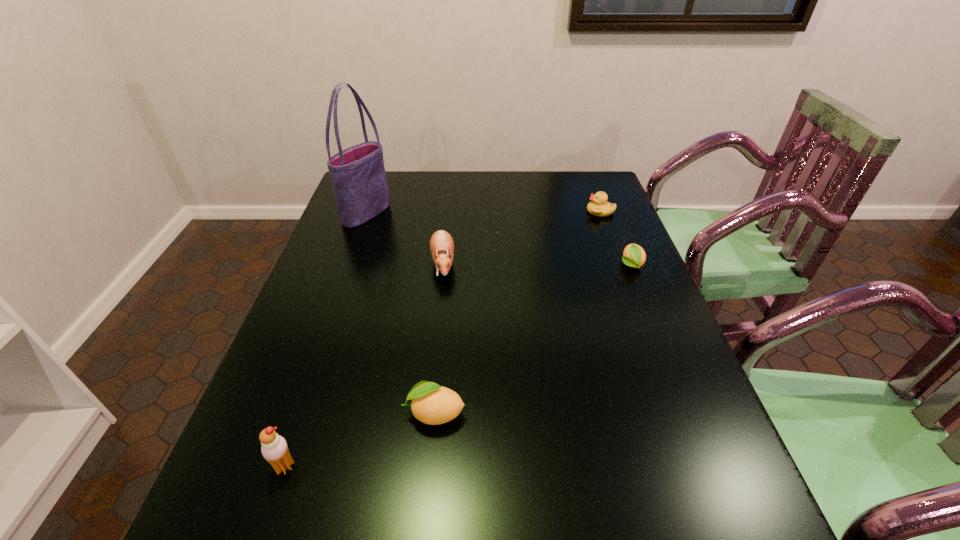
Find the location of `the nearer lemon`. the nearer lemon is located at coordinates (432, 404).

Where is `the taller lemon`? This screenshot has height=540, width=960. the taller lemon is located at coordinates (432, 404).

Locate an element on the screen. This screenshot has width=960, height=540. the farther lemon is located at coordinates (634, 256).

The image size is (960, 540). What are the coordinates of `the right lemon` in the screenshot? It's located at (634, 256).

Find the location of `hamster`. hamster is located at coordinates (441, 243).

Find the location of a particular element. duckling is located at coordinates (598, 206).

Where is `the tallest object`? The height and width of the screenshot is (540, 960). the tallest object is located at coordinates (358, 176).

At what (x,y) coordinates should I click in order to perform the action: click on icecream. Please return your answer as a coordinate pair (x, y). The height and width of the screenshot is (540, 960). Looking at the image, I should click on (274, 449).

Locate an element on the screen. The image size is (960, 540). the second tallest object is located at coordinates (274, 449).

Identify the location of blank area located 0.100m with leaves positioned above the left lemon. This screenshot has width=960, height=540. (354, 413).